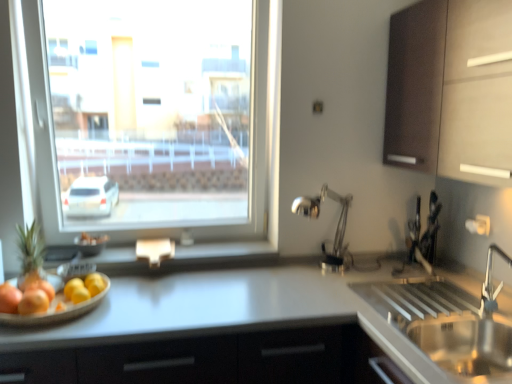
Question: In terms of width, does green matte pineapple at left look wider or thinner when compared to smooth wooden tray at lower left, which is the 2th fruit in right-to-left order?

Choices:
 (A) wide
 (B) thin

Answer: (B)

Question: Relative to smooth wooden tray at lower left, which is the 1th fruit from left to right, is green matte pineapple at left in front or behind?

Choices:
 (A) front
 (B) behind

Answer: (B)

Question: Estimate the real-world distances between objects in this image. Which object is farther from the metallic silver window sill at center?

Choices:
 (A) smooth wooden tray at lower left, which is the 1th fruit from left to right
 (B) translucent glass bowl at left
 (C) green matte pineapple at left
 (D) satin nickel sink at lower right
 (E) silver metallic faucet at right

Answer: (D)

Question: Estimate the real-world distances between objects in this image. Which object is farther from the yellow matte lemon at lower left, the 1th fruit positioned from the right?

Choices:
 (A) silver metallic faucet at right
 (B) translucent glass bowl at left
 (C) smooth wooden tray at lower left, which is the 2th fruit in right-to-left order
 (D) white glossy countertop at center
 (E) dark wood cabinet at upper right

Answer: (E)